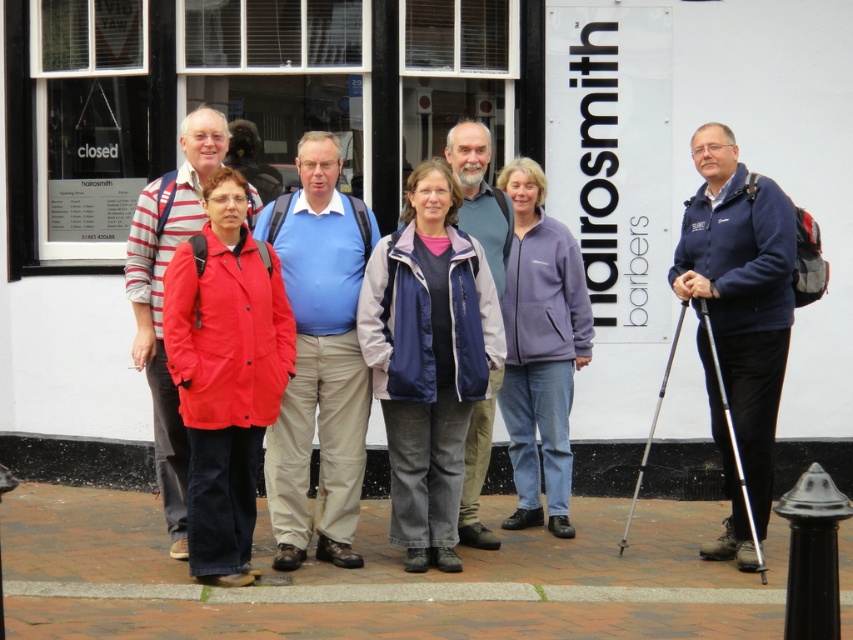
Does navy blue fabric jacket at center have a lesser height compared to purple fleece jacket at center?

Yes.

Between point (404, 568) and point (527, 317), which one is positioned behind?

Positioned behind is point (527, 317).

The width and height of the screenshot is (853, 640). Find the location of `navy blue fabric jacket at center`. navy blue fabric jacket at center is located at coordinates (428, 358).

Is point (264, 349) farther from camera compared to point (364, 380)?

No, (264, 349) is closer to viewer.

Does point (252, 278) come farther from viewer compared to point (361, 448)?

No, it is not.

Image resolution: width=853 pixels, height=640 pixels. What are the coordinates of `matte red coat at center` in the screenshot? It's located at (225, 372).

Can you confirm if navy blue fabric jacket at center is positioned to the left of matte red coat at center?

Incorrect, navy blue fabric jacket at center is not on the left side of matte red coat at center.

Is point (426, 332) positioned after point (236, 460)?

Yes.

Locate an element on the screen. Image resolution: width=853 pixels, height=640 pixels. navy blue fabric jacket at center is located at coordinates (428, 358).